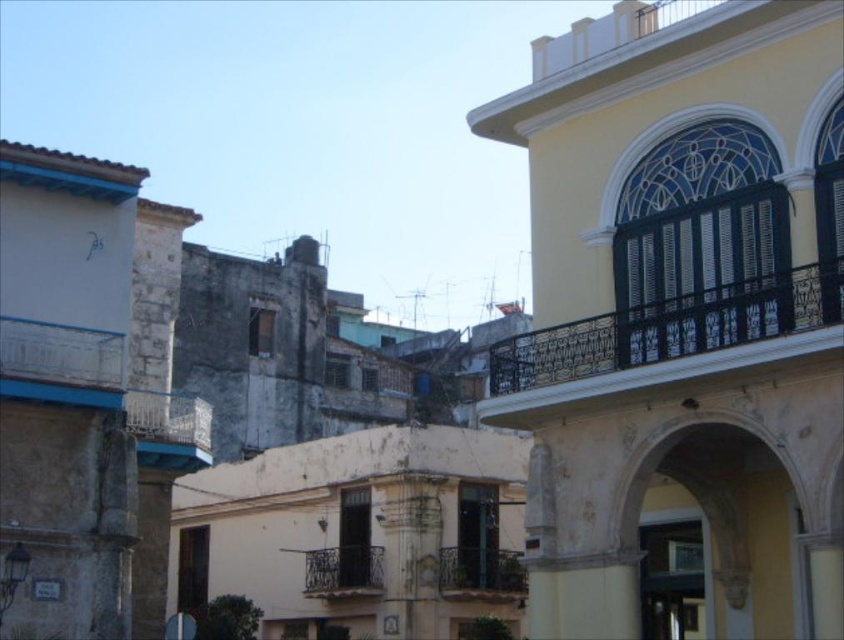
You are standing on the street looking at the historic buildings. There are two points marked on the buildings in the scene. The first point is at coordinates point (496, 586) and the second is at point (309, 592). Which of these points is closer to you?

Point (496, 586) is closer to the viewer than point (309, 592).

Consider the image. You are an architect analyzing the historic buildings in the image. You notice the stone archway at center and the black wrought iron balcony at center. Which one is positioned more to the east side of the image?

The black wrought iron balcony at center is positioned more to the east side of the image because the stone archway at center is to the right of it, implying the balcony is to the left, which would be east if the image is viewed with standard orientation.

You are an architect examining the historic buildings in this scene. You notice the stone archway at center and the black wrought iron balcony at center. Which architectural element is bigger in terms of physical size?

The stone archway at center is larger in size than the black wrought iron balcony at center, so the stone archway at center is bigger.